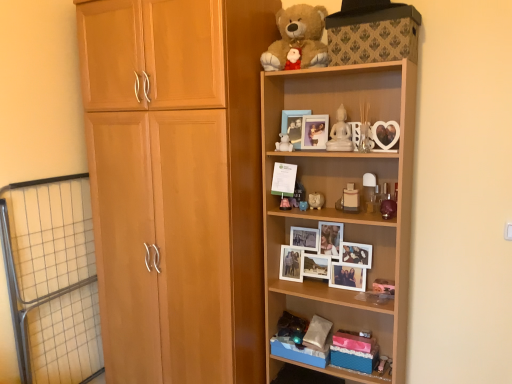
Question: From the image's perspective, is matte plastic perfume bottle at center, arranged as the 5th toy when viewed from the left, located above or below wooden shelf at upper right, the first shelf when ordered from top to bottom?

Choices:
 (A) above
 (B) below

Answer: (A)

Question: Does point (346, 200) appear closer or farther from the camera than point (377, 165)?

Choices:
 (A) closer
 (B) farther

Answer: (B)

Question: Estimate the real-world distances between objects in this image. Which object is closer to the patterned fabric storage box at upper center?

Choices:
 (A) clear glass vase at upper center, which is the 1th toy from right to left
 (B) white marble statue at upper center, which is the 3th toy in right-to-left order
 (C) metal grid screen door at left
 (D) matte wooden picture frame at upper center, arranged as the 2th picture frame when viewed from the right
 (E) soft brown plush at upper center

Answer: (E)

Question: Based on their relative distances, which object is nearer to the wooden shelf at upper right, the second shelf in the bottom-to-top sequence?

Choices:
 (A) white matte picture frames at center, the first shelf ordered from the bottom
 (B) patterned fabric storage box at upper center
 (C) matte blue piggy bank at center, arranged as the second toy when viewed from the left
 (D) white ceramic piggy bank at center, which ranks as the fourth toy in right-to-left order
 (E) matte plastic perfume bottle at center, acting as the 2th toy starting from the right

Answer: (A)